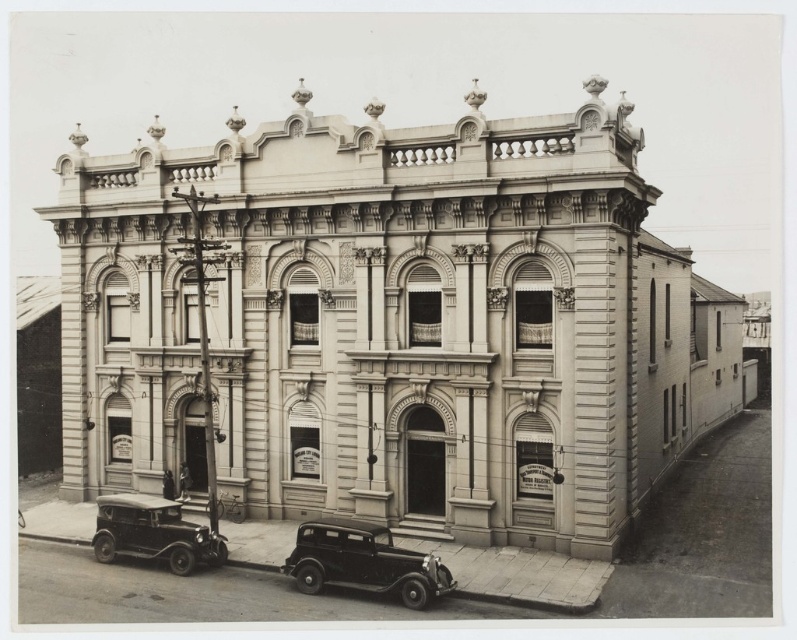
You are a photographer standing in front of the grand building and want to capture both shiny black car at lower center and shiny black car at lower left in your shot. Which car should you adjust your camera angle to include first if you want to frame them from left to right?

→ The shiny black car at lower left should be framed first since it is on the left side of the shiny black car at lower center.

You are a photographer planning to capture the grand building in this image. You want to ensure that both the shiny black car at lower center and the shiny black car at lower left are fully visible in your shot. Given their sizes, which car might require you to adjust your camera angle more to include it in the frame?

The shiny black car at lower left is longer than the shiny black car at lower center, so you might need to adjust your camera angle more to include the shiny black car at lower left in the frame.